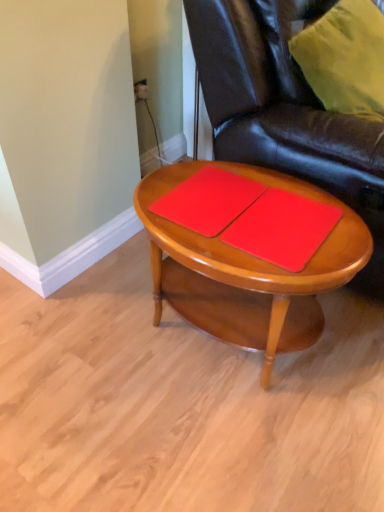
You are a GUI agent. You are given a task and a screenshot of the screen. Output one action in this format:
    pyautogui.click(x=<x>, y=<y>)
    Task: Click on the free point below red matte notebook at center, acting as the 2th notebook starting from the left (from a real-world perspective)
    
    Given the screenshot: What is the action you would take?
    pyautogui.click(x=278, y=223)